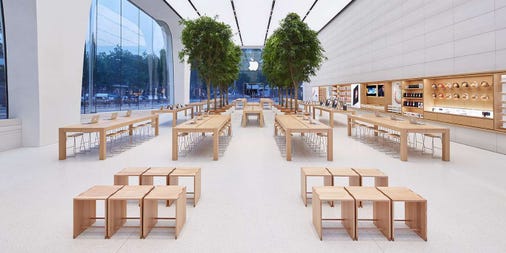
Find the location of `floor`. floor is located at coordinates (266, 201).